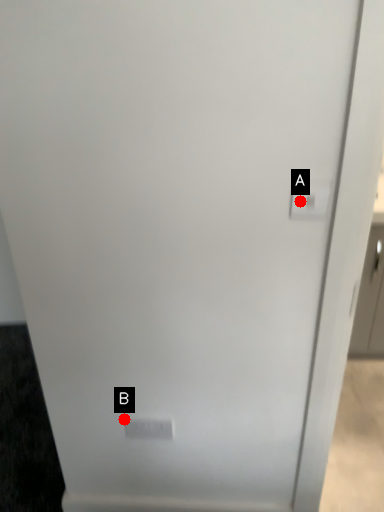
Question: Two points are circled on the image, labeled by A and B beside each circle. Which point is closer to the camera?

Choices:
 (A) A is closer
 (B) B is closer

Answer: (A)